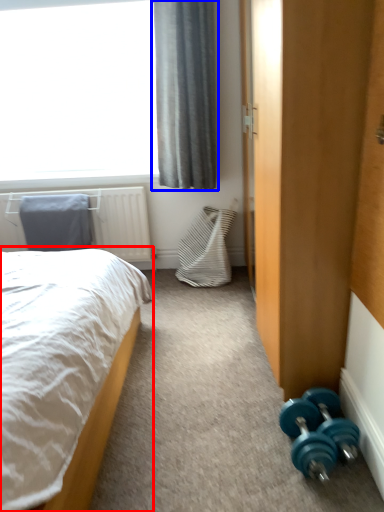
Question: Among these objects, which one is nearest to the camera, bed (highlighted by a red box) or curtain (highlighted by a blue box)?

Choices:
 (A) bed
 (B) curtain

Answer: (A)